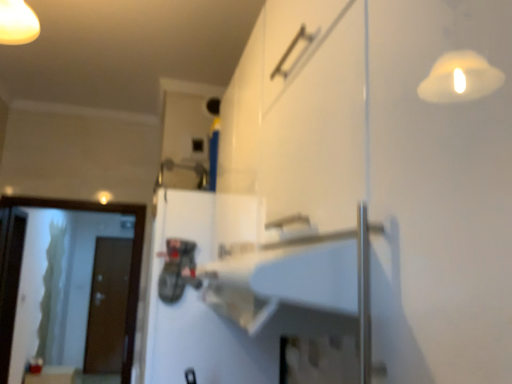
This screenshot has width=512, height=384. In order to click on free space above white glossy screen door at left, which appears as the 1th screen door when viewed from the right (from a real-world perspective) in this screenshot , I will do `click(65, 191)`.